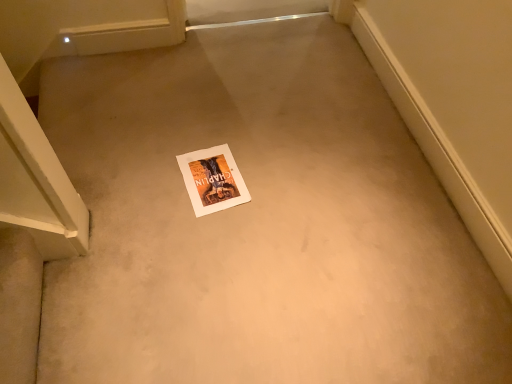
Measure the distance between carpeted stairs at lower left and camera.

carpeted stairs at lower left and camera are 97.80 centimeters apart.

This screenshot has height=384, width=512. Describe the element at coordinates (19, 306) in the screenshot. I see `carpeted stairs at lower left` at that location.

I want to click on carpeted stairs at lower left, so click(x=19, y=306).

You are a GUI agent. You are given a task and a screenshot of the screen. Output one action in this format:
    pyautogui.click(x=<x>, y=<y>)
    Task: Click on the carpeted stairs at lower left
    
    Given the screenshot: What is the action you would take?
    pyautogui.click(x=19, y=306)